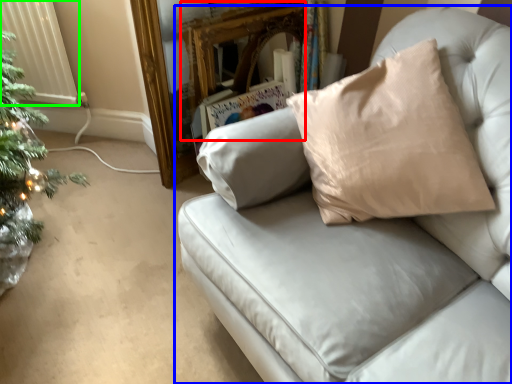
Question: Estimate the real-world distances between objects in this image. Which object is closer to mirror (highlighted by a red box), studio couch (highlighted by a blue box) or radiator (highlighted by a green box)?

Choices:
 (A) studio couch
 (B) radiator

Answer: (B)